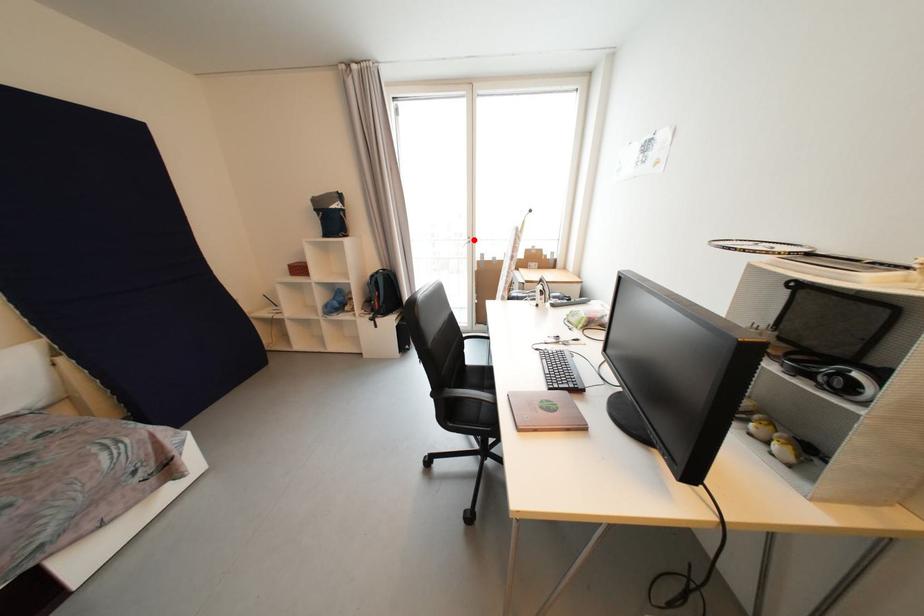
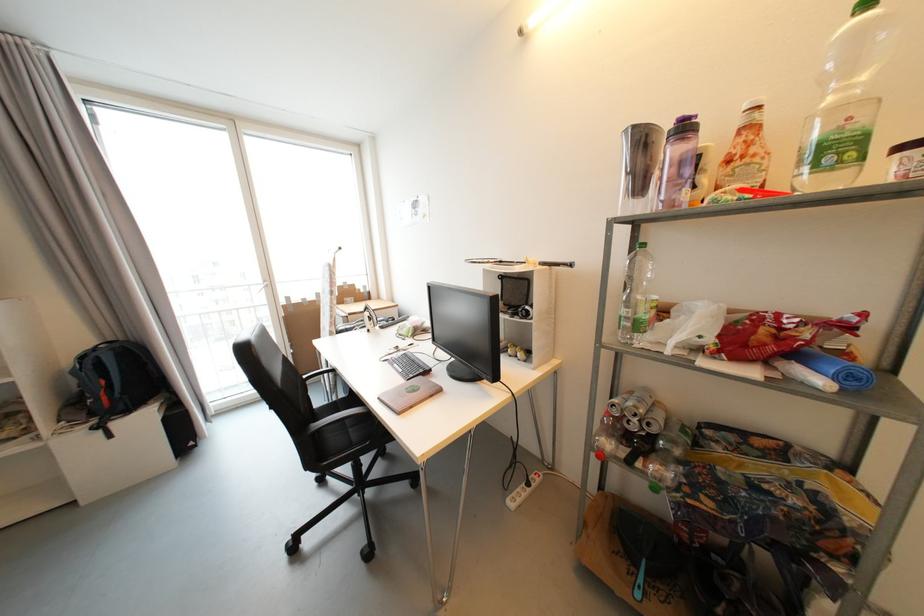
Where in the second image is the point corresponding to the highlighted location from the first image?

(271, 283)